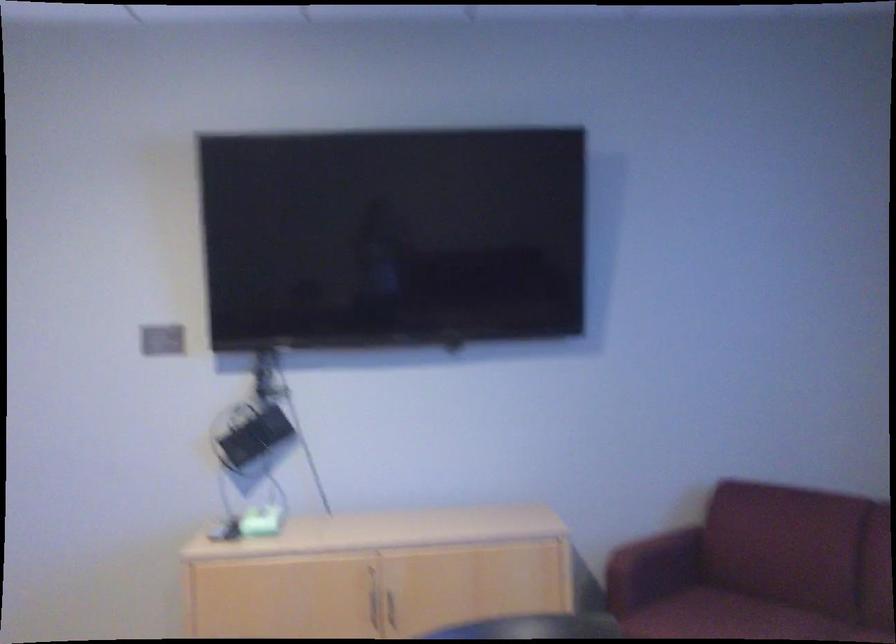
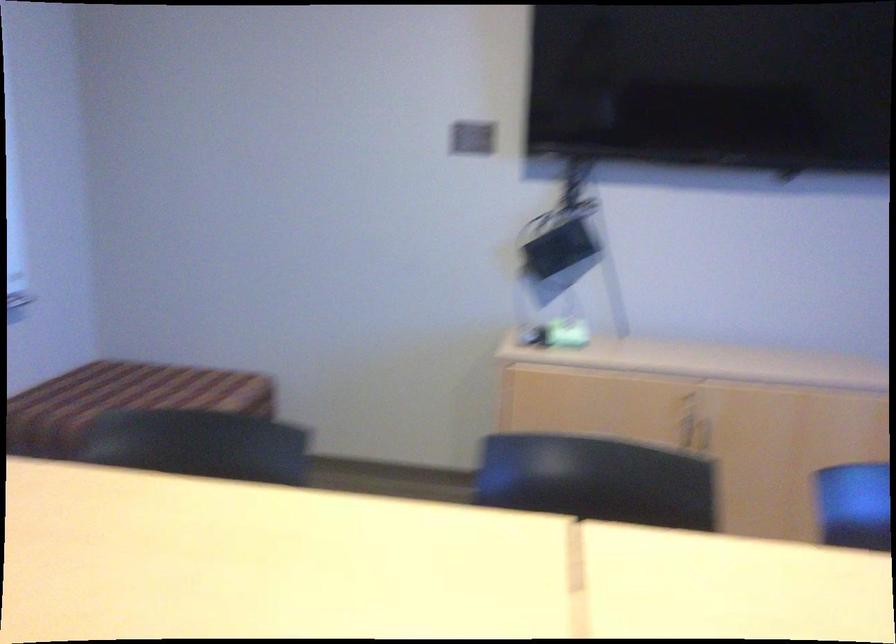
Question: Based on the continuous images, in which direction is the camera rotating? Reply with the corresponding letter.

Choices:
 (A) Left
 (B) Right
 (C) Up
 (D) Down

Answer: (D)